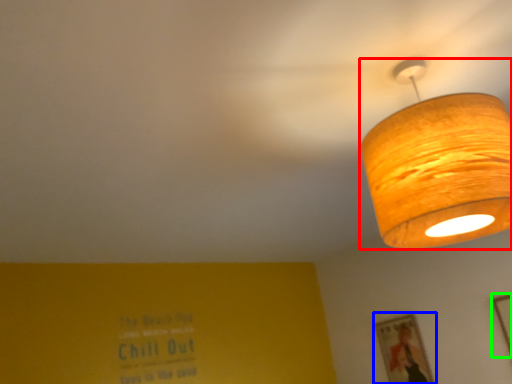
Question: Which is farther away from lamp (highlighted by a red box)? picture frame (highlighted by a blue box) or picture frame (highlighted by a green box)?

Choices:
 (A) picture frame
 (B) picture frame

Answer: (A)